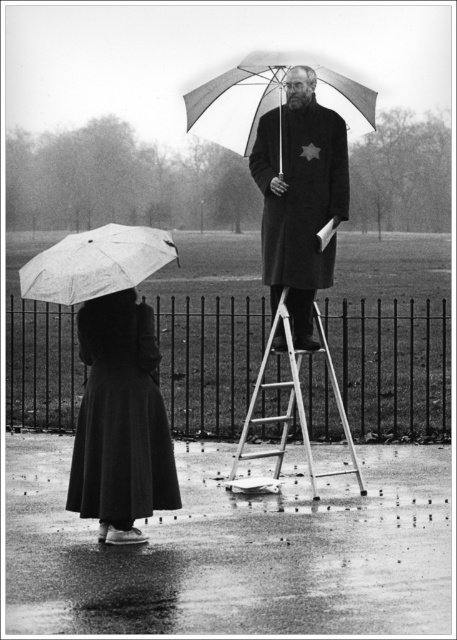
Does matte black coat at lower left appear on the left side of metallic silver ladder at center?

Indeed, matte black coat at lower left is positioned on the left side of metallic silver ladder at center.

Which is behind, point (81, 308) or point (306, 420)?

Positioned behind is point (306, 420).

What do you see at coordinates (121, 420) in the screenshot? This screenshot has width=457, height=640. I see `matte black coat at lower left` at bounding box center [121, 420].

Locate an element on the screen. matte black coat at lower left is located at coordinates (121, 420).

Is the position of matte black coat at lower left more distant than that of matte black coat at center?

No, matte black coat at lower left is in front of matte black coat at center.

Can you confirm if matte black coat at lower left is positioned to the right of matte black coat at center?

In fact, matte black coat at lower left is to the left of matte black coat at center.

What do you see at coordinates (121, 420) in the screenshot?
I see `matte black coat at lower left` at bounding box center [121, 420].

Locate an element on the screen. The image size is (457, 640). matte black coat at lower left is located at coordinates (121, 420).

Which is above, matte black coat at lower left or white matte umbrella at upper center?

white matte umbrella at upper center is above.

Can you confirm if matte black coat at lower left is positioned to the right of white matte umbrella at upper center?

In fact, matte black coat at lower left is to the left of white matte umbrella at upper center.

The image size is (457, 640). Find the location of `matte black coat at lower left`. matte black coat at lower left is located at coordinates (121, 420).